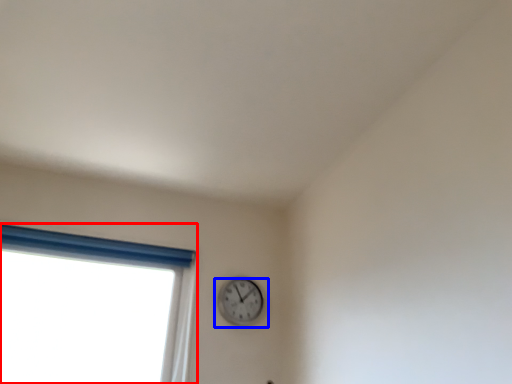
Question: Which object appears farthest to the camera in this image, window (highlighted by a red box) or wall clock (highlighted by a blue box)?

Choices:
 (A) window
 (B) wall clock

Answer: (B)